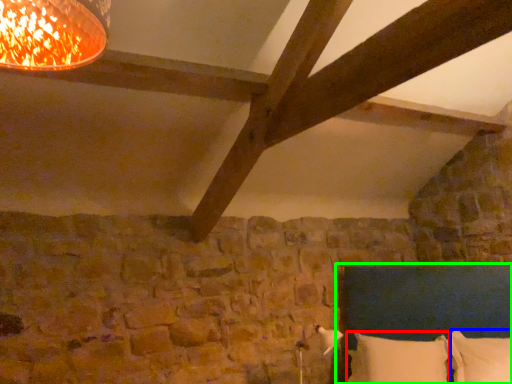
Question: Which is farther away from pillow (highlighted by a red box)? pillow (highlighted by a blue box) or bed (highlighted by a green box)?

Choices:
 (A) pillow
 (B) bed

Answer: (B)